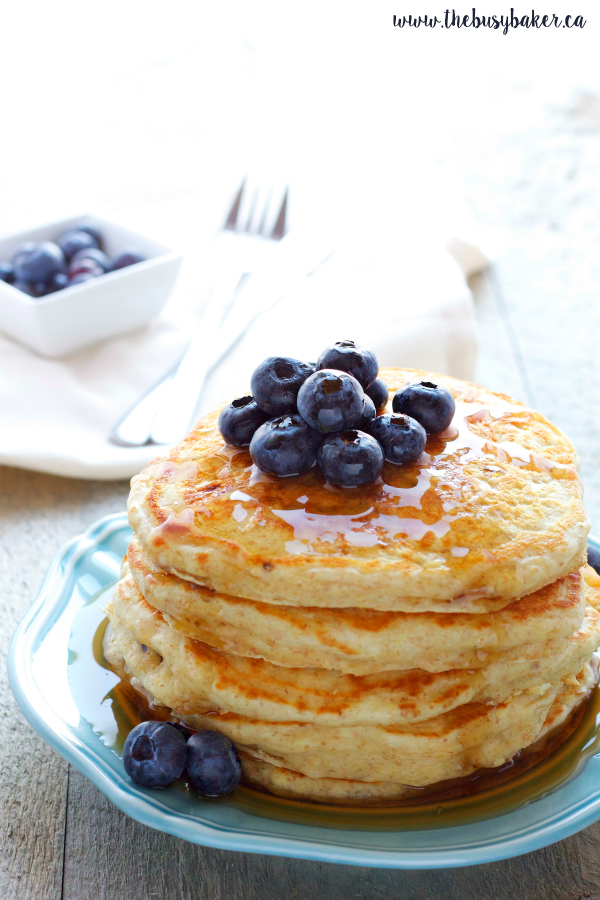
Locate an element on the screen. The image size is (600, 900). handle is located at coordinates (131, 418), (203, 352).